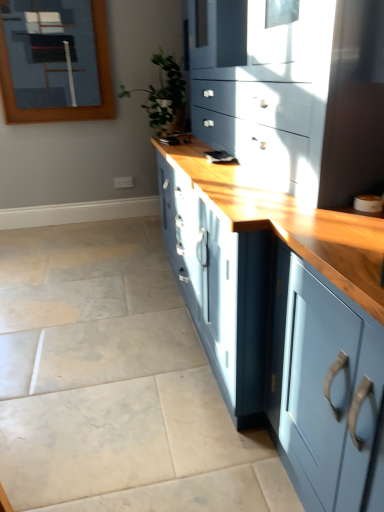
Question: From the image's perspective, would you say wooden frame at upper left is positioned over green leafy plant at center?

Choices:
 (A) no
 (B) yes

Answer: (B)

Question: From the image's perspective, is wooden frame at upper left beneath green leafy plant at center?

Choices:
 (A) yes
 (B) no

Answer: (B)

Question: From a real-world perspective, is wooden frame at upper left physically above green leafy plant at center?

Choices:
 (A) no
 (B) yes

Answer: (B)

Question: Considering the relative sizes of wooden frame at upper left and green leafy plant at center in the image provided, is wooden frame at upper left taller than green leafy plant at center?

Choices:
 (A) no
 (B) yes

Answer: (B)

Question: Is wooden frame at upper left wider than green leafy plant at center?

Choices:
 (A) no
 (B) yes

Answer: (A)

Question: Is wooden frame at upper left positioned far away from green leafy plant at center?

Choices:
 (A) yes
 (B) no

Answer: (B)

Question: Does green leafy plant at center have a greater width compared to wooden frame at upper left?

Choices:
 (A) no
 (B) yes

Answer: (B)

Question: Is green leafy plant at center turned away from wooden frame at upper left?

Choices:
 (A) no
 (B) yes

Answer: (A)

Question: Is green leafy plant at center oriented towards wooden frame at upper left?

Choices:
 (A) yes
 (B) no

Answer: (B)

Question: Is the position of green leafy plant at center less distant than that of wooden frame at upper left?

Choices:
 (A) no
 (B) yes

Answer: (B)

Question: Can you confirm if green leafy plant at center is positioned to the right of wooden frame at upper left?

Choices:
 (A) no
 (B) yes

Answer: (B)

Question: Is green leafy plant at center taller than wooden frame at upper left?

Choices:
 (A) no
 (B) yes

Answer: (A)

Question: Is green leafy plant at center thinner than matte blue cabinet at center?

Choices:
 (A) yes
 (B) no

Answer: (A)